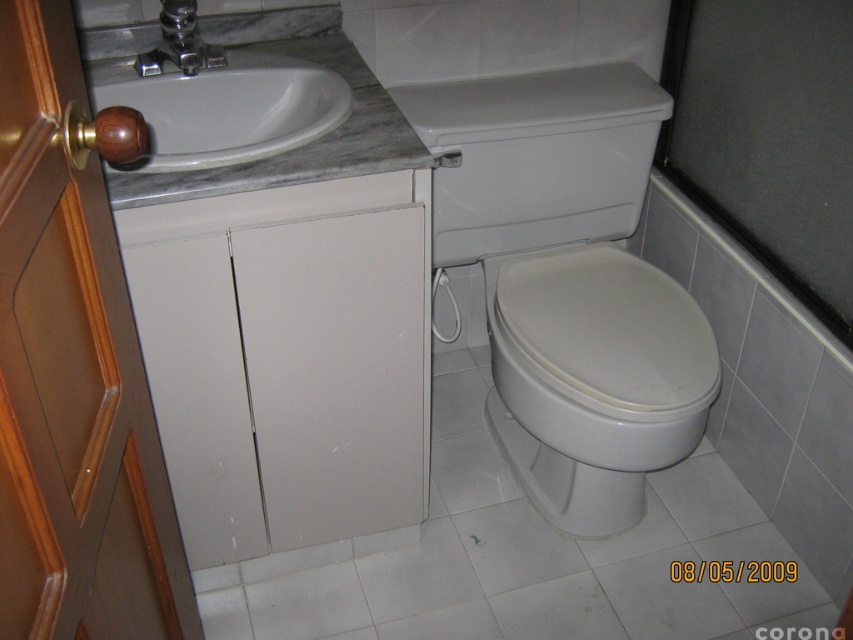
You are standing in the bathroom and need to place two decorative plants at the specified coordinates. The first plant must be placed at point [479,156], and the second at point [503,301]. Based on the bathroom layout, which plant will be closer to the sink?

Point [479,156] is behind point [503,301], so the plant at point [503,301] will be closer to the sink.

You are a bathroom designer planning to replace the white glossy toilet at center and the white glossy sink at upper left. If you want to ensure the new fixtures are the same size as the existing ones, which one should you choose a larger model for?

You should choose a larger model for the white glossy toilet at center because it is bigger than the white glossy sink at upper left.

You are a plumber needing to access the pipes behind the silver metallic faucet at upper center. Since the white glossy toilet at right is in the way, can you move it to reach the faucet?

The silver metallic faucet at upper center is behind the white glossy toilet at right, so moving the toilet would allow access to the pipes behind the faucet.